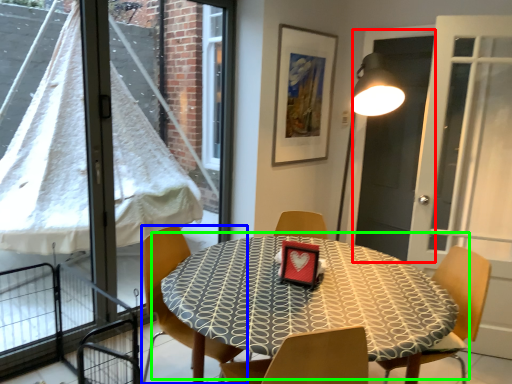
Question: Which object is positioned closest to screen door (highlighted by a red box)? Select from chair (highlighted by a blue box) and table (highlighted by a green box).

Choices:
 (A) chair
 (B) table

Answer: (B)